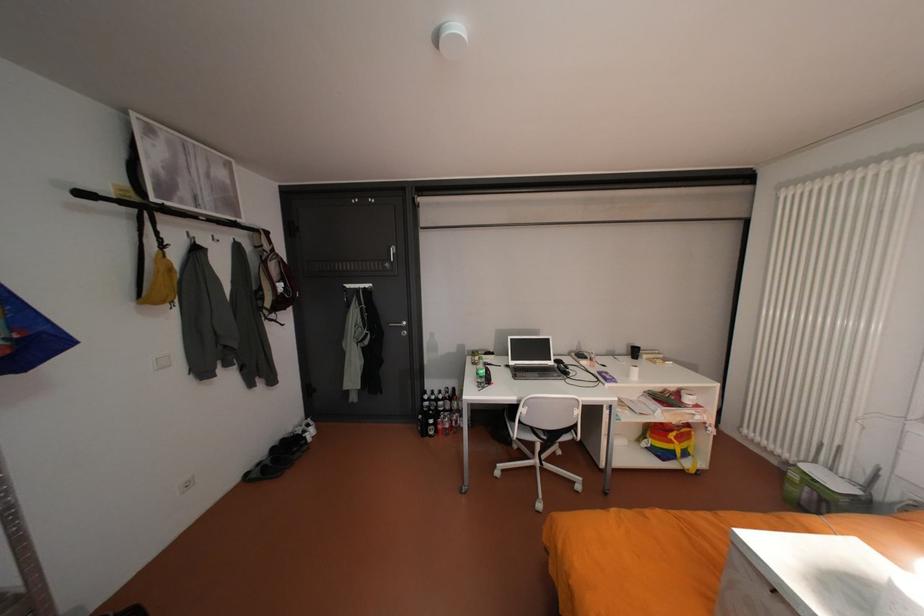
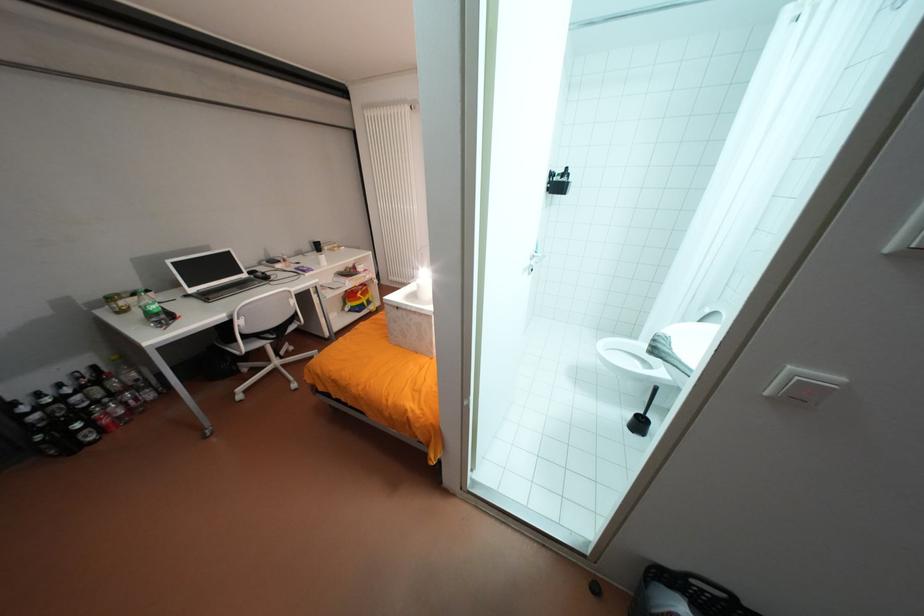
Locate, in the second image, the point that corresponds to the point at 459,410 in the first image.

(120, 394)